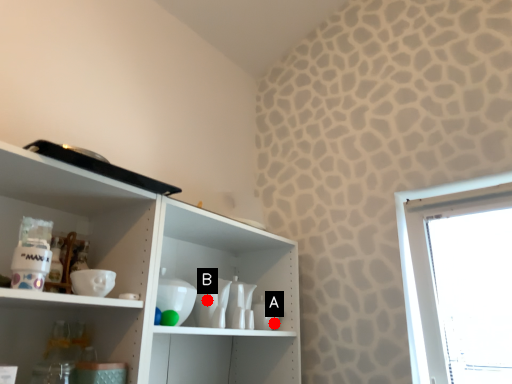
Question: Two points are circled on the image, labeled by A and B beside each circle. Among these points, which one is nearest to the camera?

Choices:
 (A) A is closer
 (B) B is closer

Answer: (B)